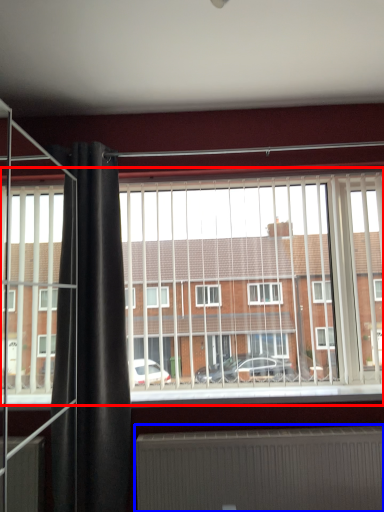
Question: Which object appears closest to the camera in this image, window (highlighted by a red box) or radiator (highlighted by a blue box)?

Choices:
 (A) window
 (B) radiator

Answer: (B)